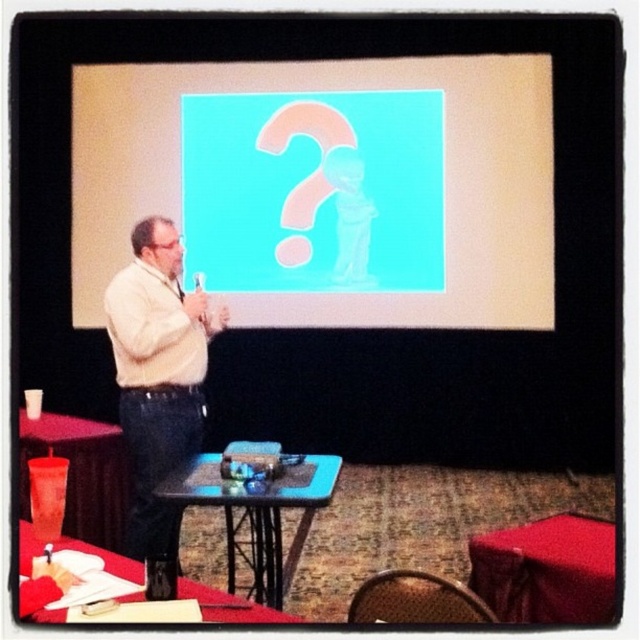
You are sitting in the audience and want to know which of the two points, point (161, 412) or point (170, 502), is closer to you. Based on the scene, can you determine this?

Point (161, 412) is closer to you than point (170, 502) because it is further to the viewer.

You are a guest at this presentation and need to place your notebook on a table. Which table, the red fabric table at lower right or the smooth wood table at lower left, would be more comfortable for writing?

The smooth wood table at lower left is more comfortable for writing because it has a greater height than the red fabric table at lower right, providing a better ergonomic position for writing.